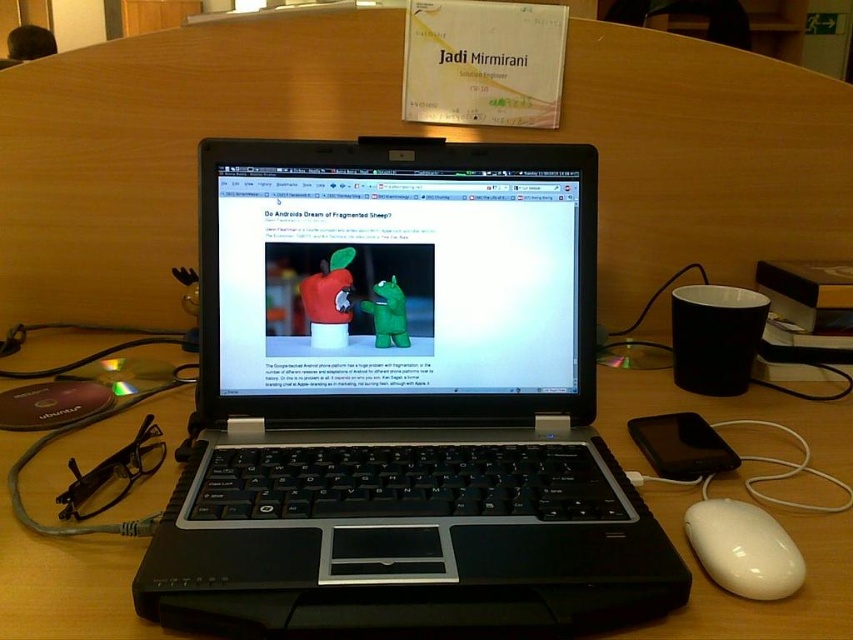
Question: Among these points, which one is nearest to the camera?

Choices:
 (A) (491, 388)
 (B) (265, 499)

Answer: (B)

Question: Can you confirm if wooden table at center is positioned below white glossy mouse at lower right?

Choices:
 (A) yes
 (B) no

Answer: (B)

Question: Is shiny black laptop at center further to the viewer compared to wooden table at center?

Choices:
 (A) yes
 (B) no

Answer: (A)

Question: Which of the following is the closest to the observer?

Choices:
 (A) (621, 456)
 (B) (387, 616)
 (C) (743, 524)
 (D) (525, 259)

Answer: (B)

Question: Among these points, which one is farthest from the camera?

Choices:
 (A) (724, 513)
 (B) (752, 634)

Answer: (A)

Question: Can you confirm if shiny black laptop at center is thinner than white glossy mouse at lower right?

Choices:
 (A) yes
 (B) no

Answer: (B)